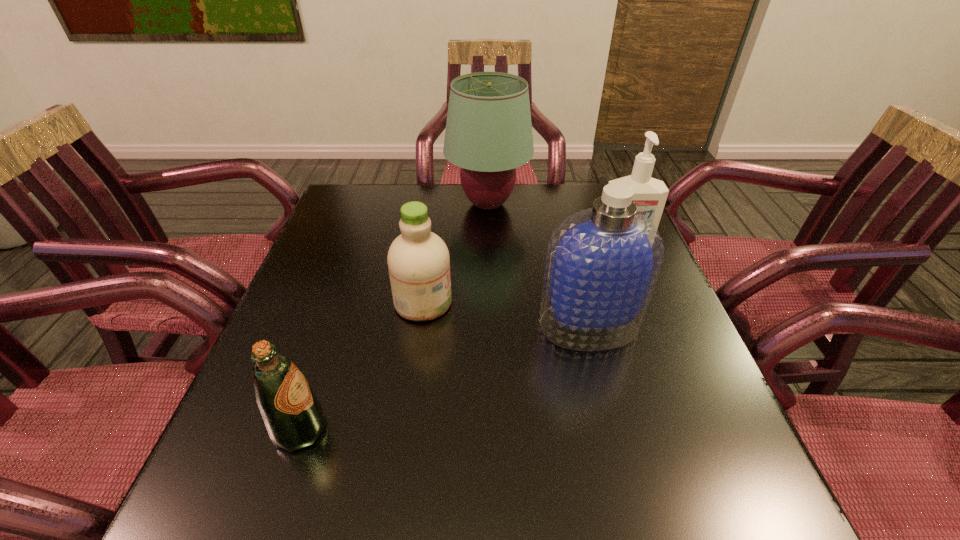
I want to click on free space between the farthest cleansing agent and the olive oil, so point(462,340).

Find the location of `free space between the leftmost object and the farthest cleansing agent`. free space between the leftmost object and the farthest cleansing agent is located at coordinates (462, 340).

Where is `blank region between the lampshade and the leftmost cleansing agent`? blank region between the lampshade and the leftmost cleansing agent is located at coordinates point(455,253).

Identify which object is the second closest to the leftmost cleansing agent. Please provide its 2D coordinates. Your answer should be formatted as a tuple, i.e. [(x, y)], where the tuple contains the x and y coordinates of a point satisfying the conditions above.

[(293, 416)]

Image resolution: width=960 pixels, height=540 pixels. Find the location of `the second closest object relative to the nearest object`. the second closest object relative to the nearest object is located at coordinates (602, 263).

Identify which cleansing agent is the third closest to the farthest object. Please provide its 2D coordinates. Your answer should be formatted as a tuple, i.e. [(x, y)], where the tuple contains the x and y coordinates of a point satisfying the conditions above.

[(602, 263)]

Identify the location of cleansing agent identified as the second closest to the shortest cleansing agent. (650, 194).

Locate an element on the screen. vacant position in the image that satisfies the following two spatial constraints: 1. on the front side of the lampshade; 2. on the front-facing side of the nearest object is located at coordinates (493, 430).

In order to click on vacant space that satisfies the following two spatial constraints: 1. on the front label of the second farthest object; 2. on the front label of the shortest cleansing agent in this screenshot , I will do `click(644, 302)`.

Locate an element on the screen. free point that satisfies the following two spatial constraints: 1. on the front label of the second farthest object; 2. on the front-facing side of the nearest object is located at coordinates (695, 430).